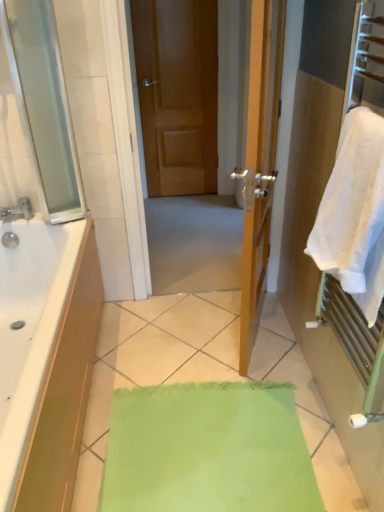
Question: From the image's perspective, is brushed metal faucet at left on white fluffy towel at right?

Choices:
 (A) yes
 (B) no

Answer: (A)

Question: Is brushed metal faucet at left positioned before white fluffy towel at right?

Choices:
 (A) yes
 (B) no

Answer: (B)

Question: Is brushed metal faucet at left further to the viewer compared to white fluffy towel at right?

Choices:
 (A) yes
 (B) no

Answer: (A)

Question: Does brushed metal faucet at left have a lesser height compared to white fluffy towel at right?

Choices:
 (A) no
 (B) yes

Answer: (B)

Question: From the image's perspective, would you say brushed metal faucet at left is shown under white fluffy towel at right?

Choices:
 (A) yes
 (B) no

Answer: (B)

Question: Is brushed metal faucet at left next to white fluffy towel at right?

Choices:
 (A) yes
 (B) no

Answer: (B)

Question: Considering the relative sizes of matte wooden door at center and brushed metal faucet at left in the image provided, is matte wooden door at center wider than brushed metal faucet at left?

Choices:
 (A) yes
 (B) no

Answer: (B)

Question: Is matte wooden door at center taller than brushed metal faucet at left?

Choices:
 (A) yes
 (B) no

Answer: (A)

Question: Can you confirm if matte wooden door at center is bigger than brushed metal faucet at left?

Choices:
 (A) yes
 (B) no

Answer: (A)

Question: Does matte wooden door at center turn towards brushed metal faucet at left?

Choices:
 (A) yes
 (B) no

Answer: (B)

Question: Is matte wooden door at center facing away from brushed metal faucet at left?

Choices:
 (A) yes
 (B) no

Answer: (B)

Question: Is matte wooden door at center next to brushed metal faucet at left and touching it?

Choices:
 (A) no
 (B) yes

Answer: (A)

Question: From a real-world perspective, is white fluffy towel at right below brushed metal faucet at left?

Choices:
 (A) yes
 (B) no

Answer: (B)